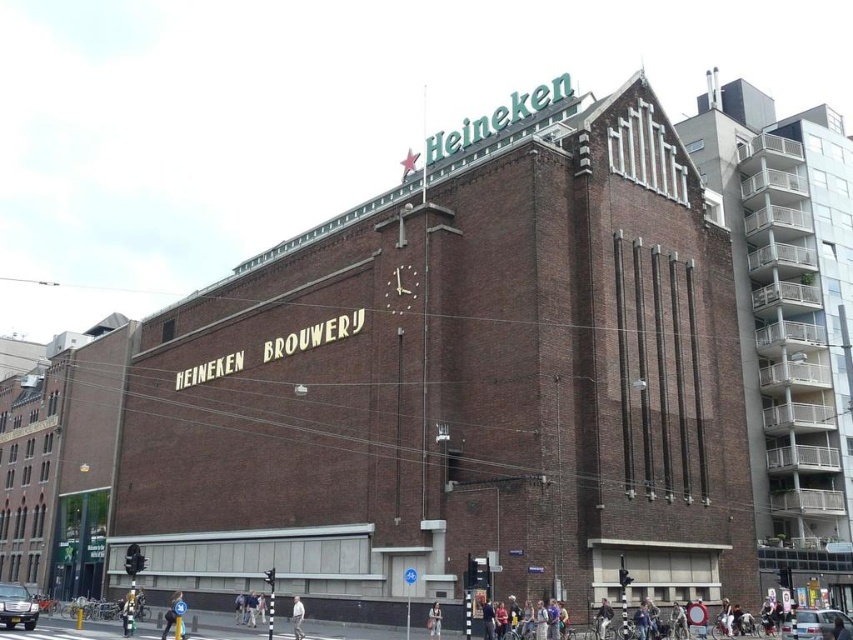
You are a window cleaner standing at the base of the Heineken building. You need to clean both the denim jacket at center and the metallic star at upper center. Which object will require you to climb higher to reach?

The metallic star at upper center is taller than the denim jacket at center, so you will need to climb higher to reach the metallic star at upper center.